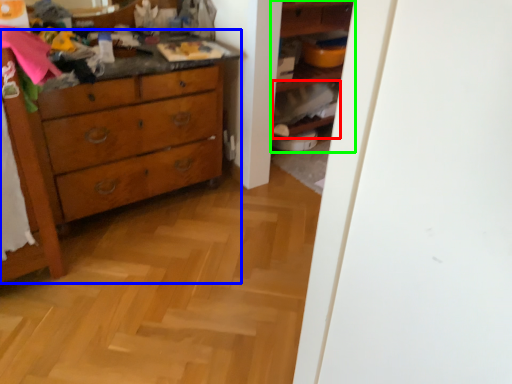
Question: Which object is the closest to the cabinet (highlighted by a red box)? Choose among these: chest of drawers (highlighted by a blue box) or shelf (highlighted by a green box).

Choices:
 (A) chest of drawers
 (B) shelf

Answer: (B)